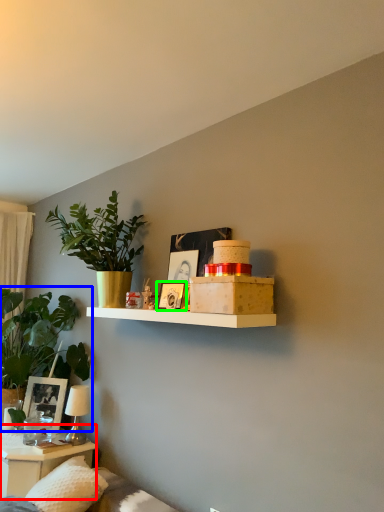
Question: Which object is the closest to the table (highlighted by a red box)? Choose among these: houseplant (highlighted by a blue box) or picture frame (highlighted by a green box).

Choices:
 (A) houseplant
 (B) picture frame

Answer: (A)